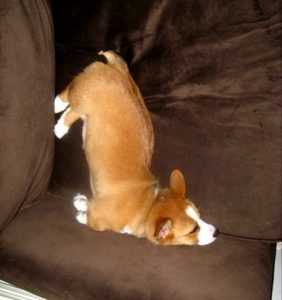
At what (x,y) coordinates should I click in order to perform the action: click on brown cushion seat. Please return your answer as a coordinate pair (x, y). The image size is (282, 300). Looking at the image, I should click on (186, 273).